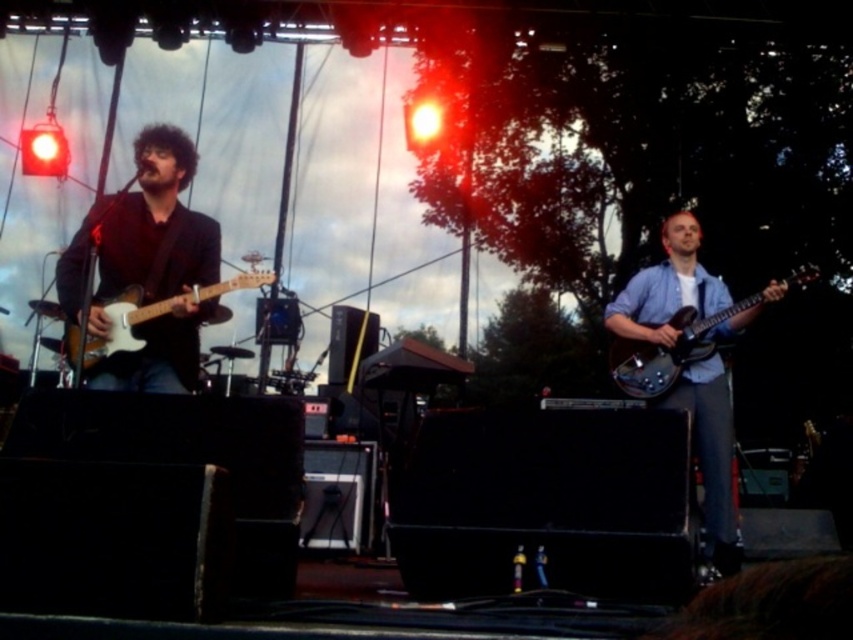
Question: Among these objects, which one is nearest to the camera?

Choices:
 (A) blue denim shirt at right
 (B) glossy black guitar at right
 (C) matte wood electric guitar at left

Answer: (A)

Question: Does glossy black guitar at right have a smaller size compared to matte wood electric guitar at left?

Choices:
 (A) no
 (B) yes

Answer: (B)

Question: Estimate the real-world distances between objects in this image. Which object is farther from the blue denim shirt at right?

Choices:
 (A) matte wood electric guitar at left
 (B) matte black guitar at left
 (C) glossy black guitar at right

Answer: (B)

Question: Which of these objects is positioned closest to the matte wood electric guitar at left?

Choices:
 (A) glossy black guitar at right
 (B) matte black guitar at left
 (C) blue denim shirt at right

Answer: (B)

Question: Can you confirm if matte black guitar at left is bigger than blue denim shirt at right?

Choices:
 (A) yes
 (B) no

Answer: (B)

Question: Does blue denim shirt at right have a lesser width compared to matte wood electric guitar at left?

Choices:
 (A) yes
 (B) no

Answer: (A)